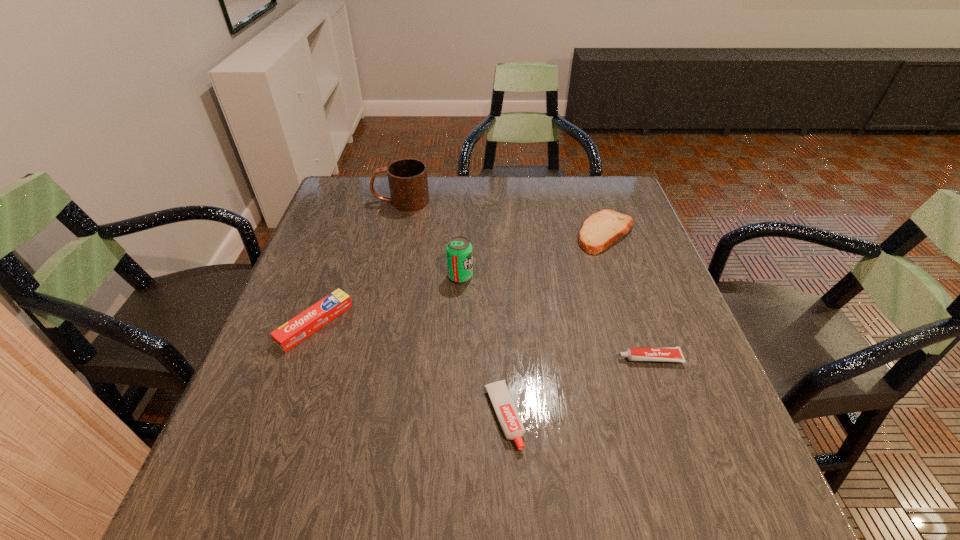
Find the location of a particular element. Image resolution: width=960 pixels, height=540 pixels. the farthest object is located at coordinates (408, 182).

At what (x,y) coordinates should I click in order to perform the action: click on the third object from left to right. Please return your answer as a coordinate pair (x, y). This screenshot has width=960, height=540. Looking at the image, I should click on (459, 250).

Locate an element on the screen. the third farthest object is located at coordinates (x=459, y=250).

I want to click on pita bread, so point(602,229).

Where is `the leftmost toothpaste`? The width and height of the screenshot is (960, 540). the leftmost toothpaste is located at coordinates (294, 331).

Where is `the fourth object from left to right`? The height and width of the screenshot is (540, 960). the fourth object from left to right is located at coordinates (505, 409).

Where is `the nearest object`? the nearest object is located at coordinates (505, 409).

What are the coordinates of `the rightmost toothpaste` in the screenshot? It's located at (667, 354).

What are the coordinates of `free region located 0.120m on the side of the mug with the handle` in the screenshot? It's located at (333, 201).

Find the location of `vacant position located 0.050m on the front-facing side of the third object from left to right`. vacant position located 0.050m on the front-facing side of the third object from left to right is located at coordinates (493, 276).